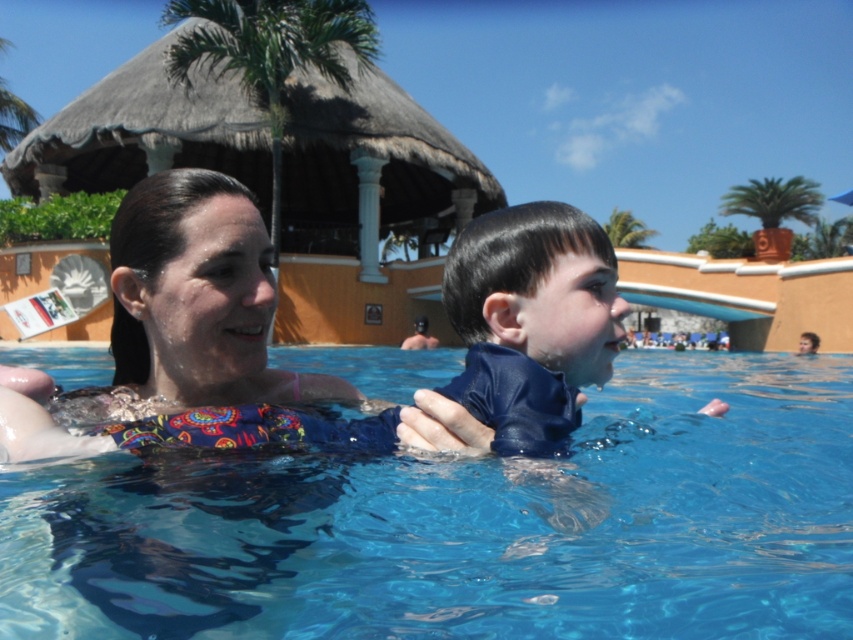
Question: Is the position of transparent blue water at center more distant than that of blue matte wetsuit at center?

Choices:
 (A) no
 (B) yes

Answer: (A)

Question: Among these objects, which one is farthest from the camera?

Choices:
 (A) blue matte wetsuit at center
 (B) transparent blue water at center

Answer: (A)

Question: Can you confirm if transparent blue water at center is bigger than blue matte wetsuit at center?

Choices:
 (A) yes
 (B) no

Answer: (A)

Question: Which point appears closest to the camera in this image?

Choices:
 (A) (634, 493)
 (B) (503, 333)

Answer: (B)

Question: From the image, what is the correct spatial relationship of transparent blue water at center in relation to blue matte wetsuit at center?

Choices:
 (A) below
 (B) above

Answer: (A)